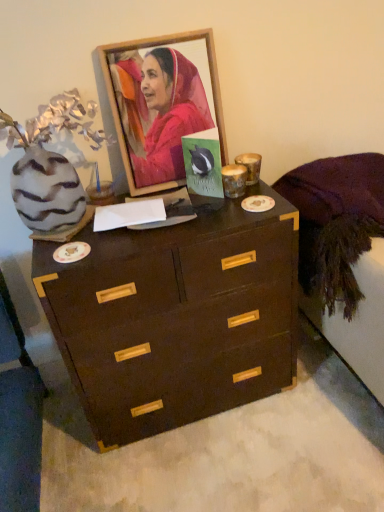
Question: From a real-world perspective, is green matte postcard at center under dark wood chest of drawers at center?

Choices:
 (A) no
 (B) yes

Answer: (A)

Question: From a real-world perspective, is green matte postcard at center positioned over dark wood chest of drawers at center based on gravity?

Choices:
 (A) no
 (B) yes

Answer: (B)

Question: Is there a large distance between green matte postcard at center and dark wood chest of drawers at center?

Choices:
 (A) yes
 (B) no

Answer: (B)

Question: Is green matte postcard at center bigger than dark wood chest of drawers at center?

Choices:
 (A) yes
 (B) no

Answer: (B)

Question: From the image's perspective, is green matte postcard at center below dark wood chest of drawers at center?

Choices:
 (A) yes
 (B) no

Answer: (B)

Question: Does green matte postcard at center have a smaller size compared to dark wood chest of drawers at center?

Choices:
 (A) no
 (B) yes

Answer: (B)

Question: Can you confirm if dark wood chest of drawers at center is bigger than green matte postcard at center?

Choices:
 (A) no
 (B) yes

Answer: (B)

Question: Can you confirm if dark wood chest of drawers at center is thinner than green matte postcard at center?

Choices:
 (A) no
 (B) yes

Answer: (A)

Question: Is dark wood chest of drawers at center far from green matte postcard at center?

Choices:
 (A) no
 (B) yes

Answer: (A)

Question: From the image's perspective, is dark wood chest of drawers at center under green matte postcard at center?

Choices:
 (A) no
 (B) yes

Answer: (B)

Question: Is dark wood chest of drawers at center positioned in front of green matte postcard at center?

Choices:
 (A) yes
 (B) no

Answer: (A)

Question: Is dark wood chest of drawers at center taller than green matte postcard at center?

Choices:
 (A) no
 (B) yes

Answer: (B)

Question: Can you confirm if purple fabric at right is taller than wooden picture frame at upper center?

Choices:
 (A) no
 (B) yes

Answer: (B)